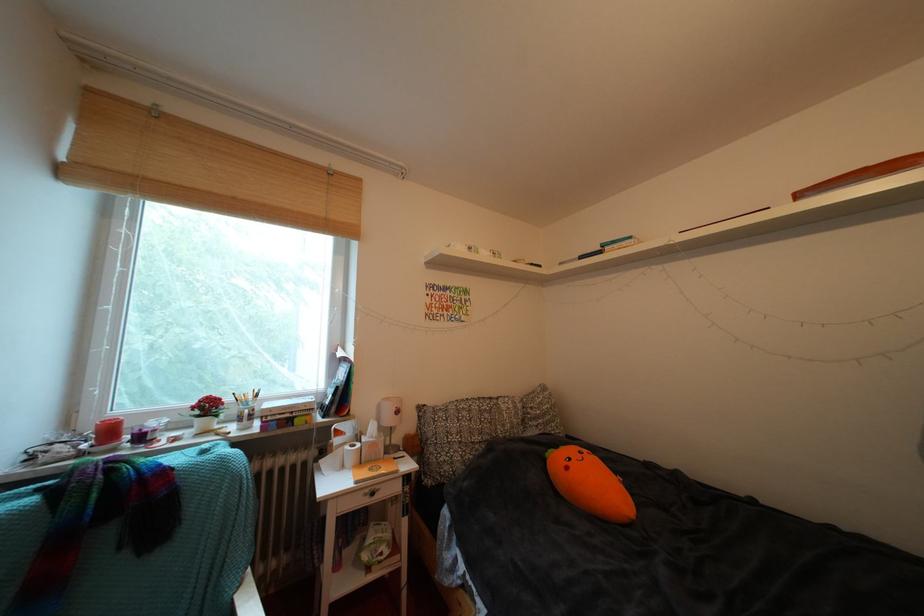
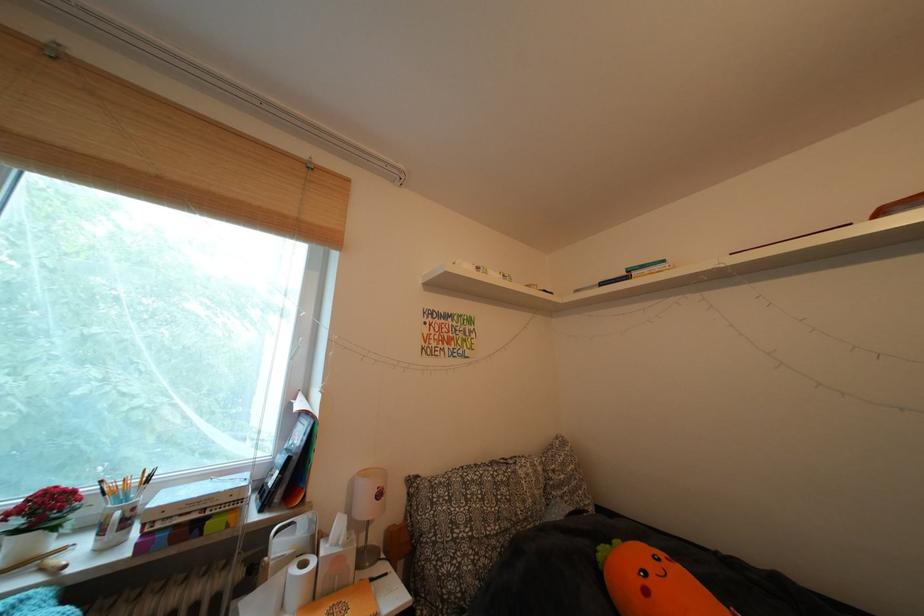
In a continuous first-person perspective shot, in which direction is the camera moving?

The cameraman moved toward left, forward.